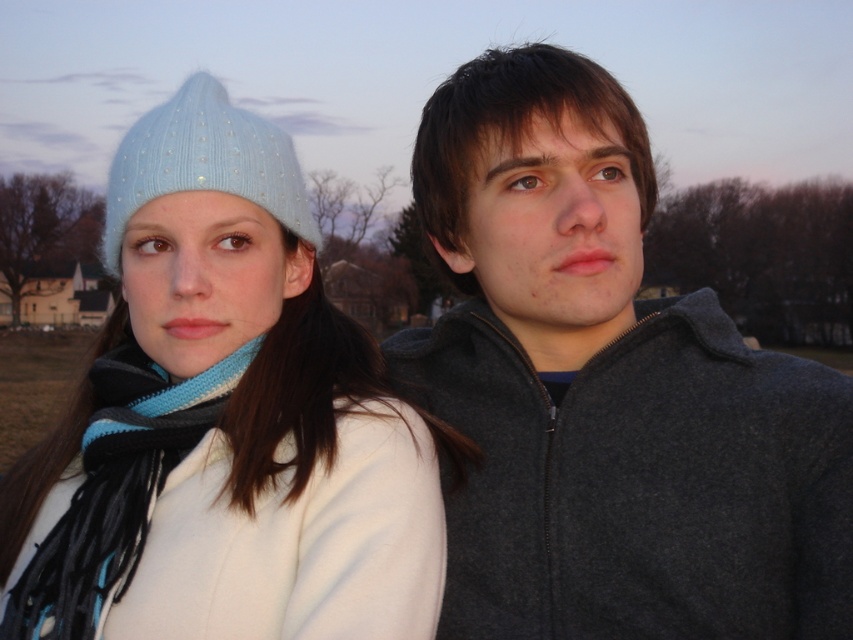
Question: Is charcoal fleece jacket at center below light blue knit beanie at upper left?

Choices:
 (A) yes
 (B) no

Answer: (B)

Question: Estimate the real-world distances between objects in this image. Which object is closer to the blue knitted scarf at left?

Choices:
 (A) charcoal fleece jacket at center
 (B) light blue knitted hat at upper left

Answer: (A)

Question: Which object appears closest to the camera in this image?

Choices:
 (A) blue knitted scarf at left
 (B) light blue knitted hat at upper left
 (C) charcoal fleece jacket at center
 (D) light blue knit beanie at upper left

Answer: (D)

Question: Does charcoal fleece jacket at center appear over light blue knitted hat at upper left?

Choices:
 (A) yes
 (B) no

Answer: (B)

Question: Which object is farther from the camera taking this photo?

Choices:
 (A) light blue knitted hat at upper left
 (B) charcoal fleece jacket at center
 (C) blue knitted scarf at left
 (D) light blue knit beanie at upper left

Answer: (A)

Question: Does blue knitted scarf at left lie in front of light blue knitted hat at upper left?

Choices:
 (A) no
 (B) yes

Answer: (B)